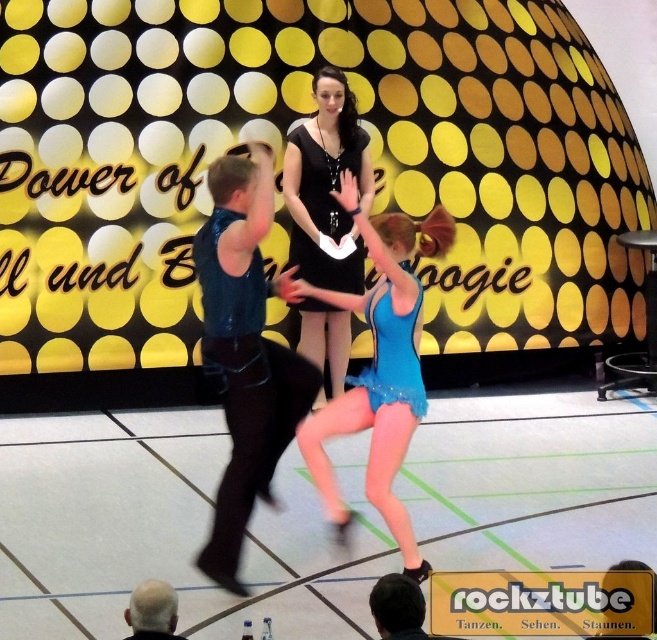
Does blue sequined dress at center have a greater height compared to gray hair at lower left?

Correct, blue sequined dress at center is much taller as gray hair at lower left.

Is blue sequined dress at center bigger than gray hair at lower left?

Correct, blue sequined dress at center is larger in size than gray hair at lower left.

The image size is (657, 640). I want to click on blue sequined dress at center, so click(x=392, y=352).

Does black satin dress at center appear over gray hair at lower left?

Correct, black satin dress at center is located above gray hair at lower left.

The image size is (657, 640). Find the location of `black satin dress at center`. black satin dress at center is located at coordinates (x=327, y=186).

Locate an element on the screen. black satin dress at center is located at coordinates (327, 186).

In the scene shown: Does shiny blue vest at center have a greater height compared to black satin dress at center?

No, shiny blue vest at center is not taller than black satin dress at center.

Which is above, shiny blue vest at center or black satin dress at center?

Positioned higher is black satin dress at center.

Is point (221, 228) closer to viewer compared to point (346, 243)?

Yes, point (221, 228) is in front of point (346, 243).

Locate an element on the screen. This screenshot has height=640, width=657. shiny blue vest at center is located at coordinates (244, 352).